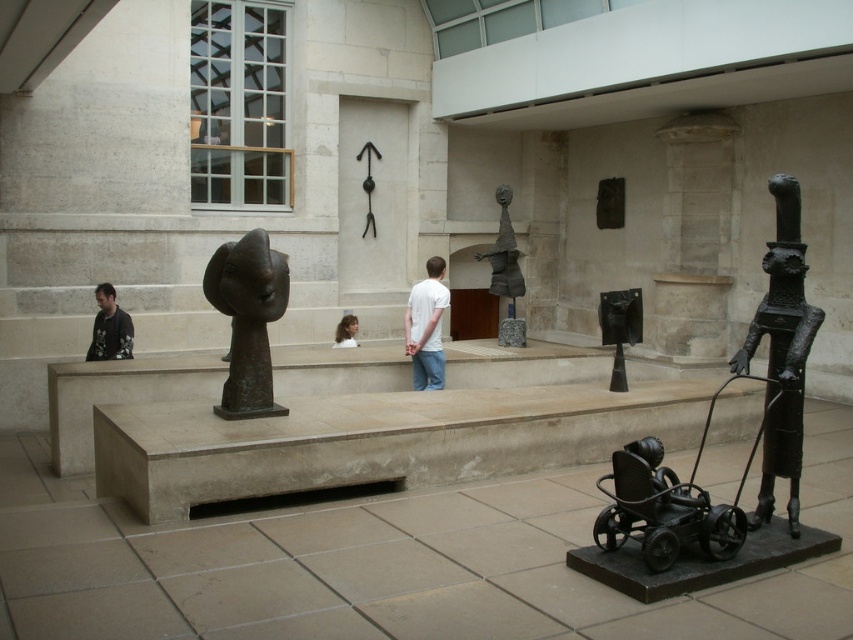
Question: Does black metal sculpture at right appear on the left side of smooth brown hair at center?

Choices:
 (A) yes
 (B) no

Answer: (B)

Question: Which of the following is the farthest from the observer?

Choices:
 (A) (509, 243)
 (B) (93, 352)
 (C) (442, 369)
 (D) (792, 435)

Answer: (A)

Question: Is bronze sculpture at center thinner than polished bronze sculpture at center?

Choices:
 (A) no
 (B) yes

Answer: (A)

Question: Which point appears farthest from the camera in this image?

Choices:
 (A) (619, 346)
 (B) (508, 291)

Answer: (B)

Question: Is polished bronze figure at center bigger than smooth brown hair at center?

Choices:
 (A) yes
 (B) no

Answer: (A)

Question: Which point is closer to the camera?

Choices:
 (A) (431, 280)
 (B) (213, 260)
 (C) (498, 259)
 (D) (630, 328)

Answer: (B)